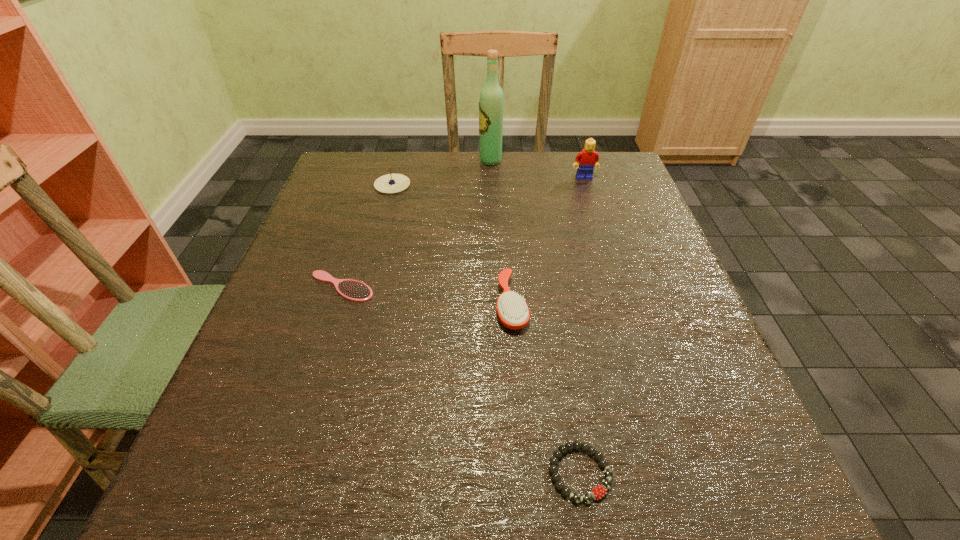
What are the coordinates of `free spot between the Lego and the second shortest object` in the screenshot? It's located at (463, 232).

Identify the location of empty location between the left hairbrush and the taller hairbrush. (426, 296).

Locate an element on the screen. This screenshot has width=960, height=540. vacant area between the left hairbrush and the bracelet is located at coordinates (461, 380).

Find the location of a particular element. The width and height of the screenshot is (960, 540). object that is the third closest to the rightmost object is located at coordinates (391, 183).

Select which object is the fifth closest to the taller hairbrush. Please provide its 2D coordinates. Your answer should be formatted as a tuple, i.e. [(x, y)], where the tuple contains the x and y coordinates of a point satisfying the conditions above.

[(491, 102)]

This screenshot has width=960, height=540. I want to click on vacant space that satisfies the following two spatial constraints: 1. on the front-facing side of the farthest object; 2. on the right side of the shortest object, so click(x=501, y=473).

Identify the location of free spot that satisfies the following two spatial constraints: 1. on the front side of the shorter hairbrush; 2. on the left side of the shortest object. This screenshot has width=960, height=540. (282, 473).

Locate an element on the screen. The height and width of the screenshot is (540, 960). vacant area in the image that satisfies the following two spatial constraints: 1. on the front-facing side of the farthest object; 2. on the back side of the nearest object is located at coordinates (501, 473).

You are a GUI agent. You are given a task and a screenshot of the screen. Output one action in this format:
    pyautogui.click(x=<x>, y=<y>)
    Task: Click on the free space that satisfies the following two spatial constraints: 1. on the front-facing side of the right hairbrush; 2. on the left side of the tallest object
    This screenshot has height=540, width=960.
    Given the screenshot: What is the action you would take?
    pyautogui.click(x=495, y=305)

You are a GUI agent. You are given a task and a screenshot of the screen. Output one action in this format:
    pyautogui.click(x=<x>, y=<y>)
    Task: Click on the free space that satisfies the following two spatial constraints: 1. on the front side of the taller hairbrush; 2. on the right side of the nearest object
    
    Given the screenshot: What is the action you would take?
    pyautogui.click(x=523, y=473)